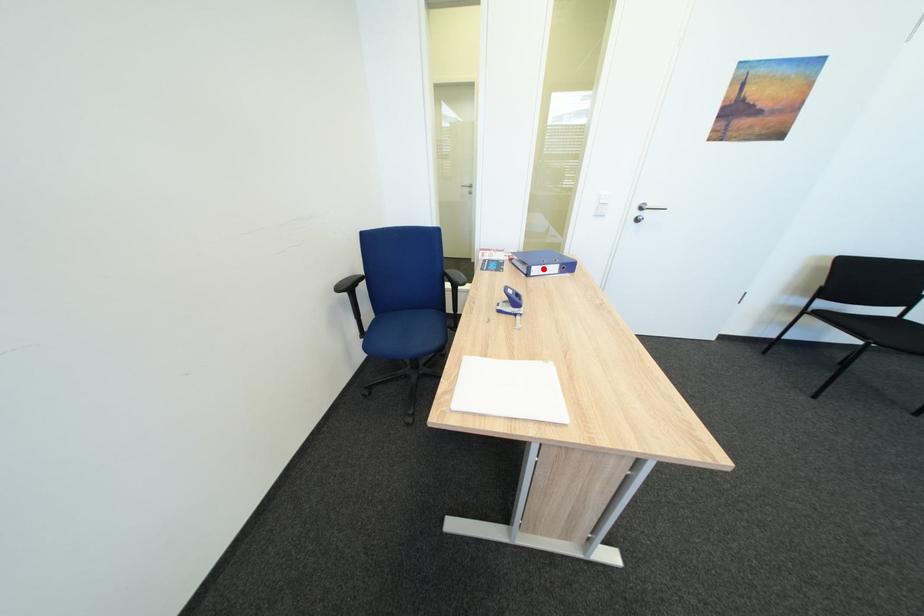
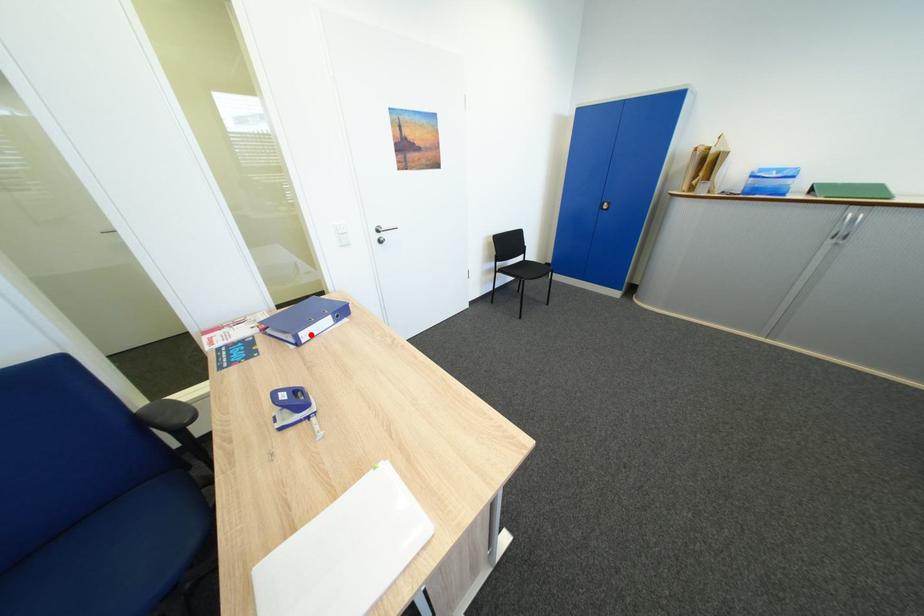
I am providing you with two images of the same scene from different viewpoints. A red point is marked on the first image and another point is marked on the second image. Is the marked point in image1 the same physical position as the marked point in image2?

Yes